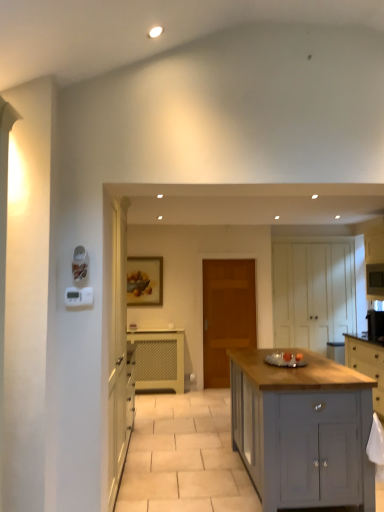
Question: Is light gray wood cabinet at right, the 2th cabinetry positioned from the right, facing away from white wood cabinet at center, arranged as the fifth cabinetry when viewed from the front?

Choices:
 (A) yes
 (B) no

Answer: (B)

Question: Can you confirm if light gray wood cabinet at right, placed as the second cabinetry when sorted from front to back, is shorter than white wood cabinet at center, arranged as the fifth cabinetry when viewed from the front?

Choices:
 (A) yes
 (B) no

Answer: (A)

Question: Is the position of light gray wood cabinet at right, the fourth cabinetry in the back-to-front sequence, less distant than that of white wood cabinet at center, the first cabinetry in the back-to-front sequence?

Choices:
 (A) yes
 (B) no

Answer: (A)

Question: Is light gray wood cabinet at right, which is the fourth cabinetry from left to right, wider than white wood cabinet at center, which is the 3th cabinetry from left to right?

Choices:
 (A) yes
 (B) no

Answer: (A)

Question: Is light gray wood cabinet at right, the 2th cabinetry positioned from the right, thinner than white wood cabinet at center, the first cabinetry in the back-to-front sequence?

Choices:
 (A) yes
 (B) no

Answer: (B)

Question: In the image, is wooden door at center on the left side or the right side of white wood cabinet at center, the first cabinetry in the back-to-front sequence?

Choices:
 (A) right
 (B) left

Answer: (B)

Question: Looking at the image, does wooden door at center seem bigger or smaller compared to white wood cabinet at center, which is the 3th cabinetry from left to right?

Choices:
 (A) small
 (B) big

Answer: (A)

Question: From a real-world perspective, relative to white wood cabinet at center, which is the 3th cabinetry from left to right, is wooden door at center vertically above or below?

Choices:
 (A) below
 (B) above

Answer: (A)

Question: Does point (223, 320) appear closer or farther from the camera than point (344, 288)?

Choices:
 (A) farther
 (B) closer

Answer: (A)

Question: Considering the relative positions of light gray wood cabinet at right, the 2th cabinetry positioned from the right, and white matte cabinet at right, the third cabinetry positioned from the back, in the image provided, is light gray wood cabinet at right, the 2th cabinetry positioned from the right, to the left or to the right of white matte cabinet at right, the third cabinetry positioned from the back,?

Choices:
 (A) right
 (B) left

Answer: (B)

Question: In the image, is light gray wood cabinet at right, which is the fourth cabinetry from left to right, positioned in front of or behind white matte cabinet at right, the third cabinetry positioned from the back?

Choices:
 (A) front
 (B) behind

Answer: (A)

Question: From a real-world perspective, relative to white matte cabinet at right, the fifth cabinetry in the left-to-right sequence, is light gray wood cabinet at right, which is the fourth cabinetry from left to right, vertically above or below?

Choices:
 (A) below
 (B) above

Answer: (A)

Question: Is light gray wood cabinet at right, which is the fourth cabinetry from left to right, spatially inside white matte cabinet at right, which ranks as the 1th cabinetry in right-to-left order, or outside of it?

Choices:
 (A) inside
 (B) outside

Answer: (B)

Question: From a real-world perspective, is white matte cabinet at right, which ranks as the third cabinetry in front-to-back order, physically located above or below wooden door at center?

Choices:
 (A) below
 (B) above

Answer: (B)

Question: Considering the relative positions of white matte cabinet at right, the third cabinetry positioned from the back, and wooden door at center in the image provided, is white matte cabinet at right, the third cabinetry positioned from the back, to the left or to the right of wooden door at center?

Choices:
 (A) left
 (B) right

Answer: (B)